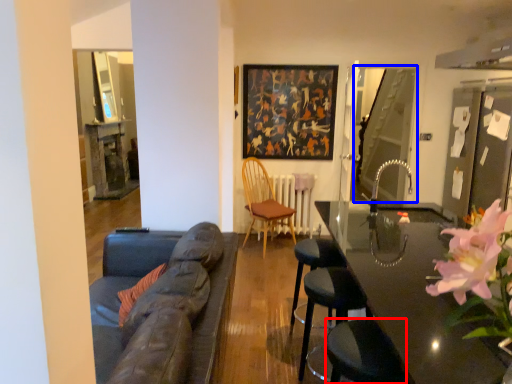
Question: Which point is further to the camera, swivel chair (highlighted by a red box) or glass door (highlighted by a blue box)?

Choices:
 (A) swivel chair
 (B) glass door

Answer: (B)